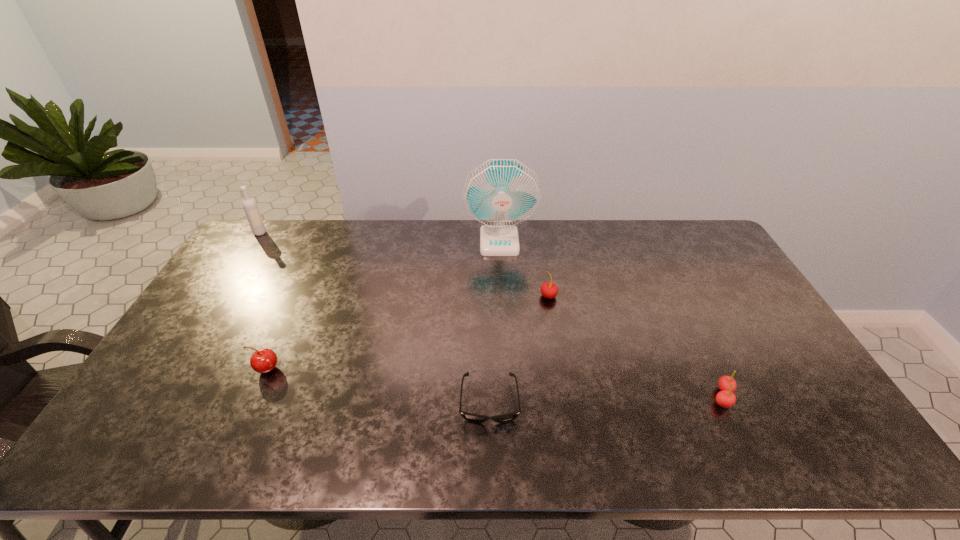
The height and width of the screenshot is (540, 960). In order to click on vacant space situated 0.350m in front of the tallest object to face the airflow in this screenshot , I will do `click(504, 331)`.

You are a GUI agent. You are given a task and a screenshot of the screen. Output one action in this format:
    pyautogui.click(x=<x>, y=<y>)
    Task: Click on the blank space located 0.140m on the front of the vodka
    
    Given the screenshot: What is the action you would take?
    [x=243, y=260]

At what (x,y) coordinates should I click in order to perform the action: click on free region located 0.310m on the back of the tallest cherry. Please return your answer as a coordinate pair (x, y). Looking at the image, I should click on (538, 234).

This screenshot has width=960, height=540. Find the location of `free space located 0.150m on the left of the second farthest cherry`. free space located 0.150m on the left of the second farthest cherry is located at coordinates (196, 369).

Locate an element on the screen. Image resolution: width=960 pixels, height=540 pixels. free space located 0.080m on the front of the rightmost object is located at coordinates (744, 442).

Find the location of `vacant point located on the front-facing side of the shortest object`. vacant point located on the front-facing side of the shortest object is located at coordinates (491, 447).

Where is `fan that is at the far edge`? The image size is (960, 540). fan that is at the far edge is located at coordinates (500, 194).

Image resolution: width=960 pixels, height=540 pixels. In order to click on vodka that is at the far edge in this screenshot , I will do `click(250, 207)`.

Image resolution: width=960 pixels, height=540 pixels. Identify the location of object positioned at the near edge. (476, 418).

Identify the location of object present at the left edge. Image resolution: width=960 pixels, height=540 pixels. (250, 207).